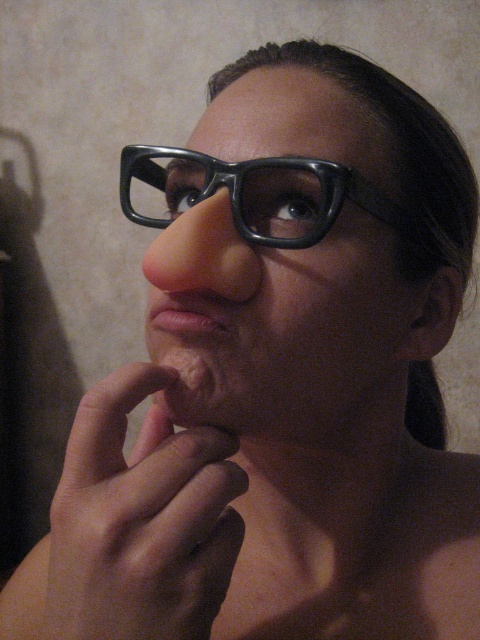
Does smooth skin hand at center have a smaller size compared to black plastic glasses at center?

Correct, smooth skin hand at center occupies less space than black plastic glasses at center.

Is smooth skin hand at center further to the viewer compared to black plastic glasses at center?

That is False.

Does point (48, 612) lie in front of point (182, 168)?

Yes, point (48, 612) is in front of point (182, 168).

Find the location of a particular element. The image size is (480, 640). smooth skin hand at center is located at coordinates (141, 520).

Which is more to the right, matte black glasses at center or matte pink lips at center?

Positioned to the right is matte black glasses at center.

Between point (241, 364) and point (148, 314), which one is positioned behind?

The point (148, 314) is behind.

Image resolution: width=480 pixels, height=640 pixels. I want to click on matte black glasses at center, so click(x=275, y=321).

Which is below, matte black glasses at center or smooth skin hand at center?

smooth skin hand at center is lower down.

In the scene shown: Can you confirm if matte black glasses at center is wider than smooth skin hand at center?

Correct, the width of matte black glasses at center exceeds that of smooth skin hand at center.

What do you see at coordinates (275, 321) in the screenshot? I see `matte black glasses at center` at bounding box center [275, 321].

Locate an element on the screen. The width and height of the screenshot is (480, 640). matte black glasses at center is located at coordinates (275, 321).